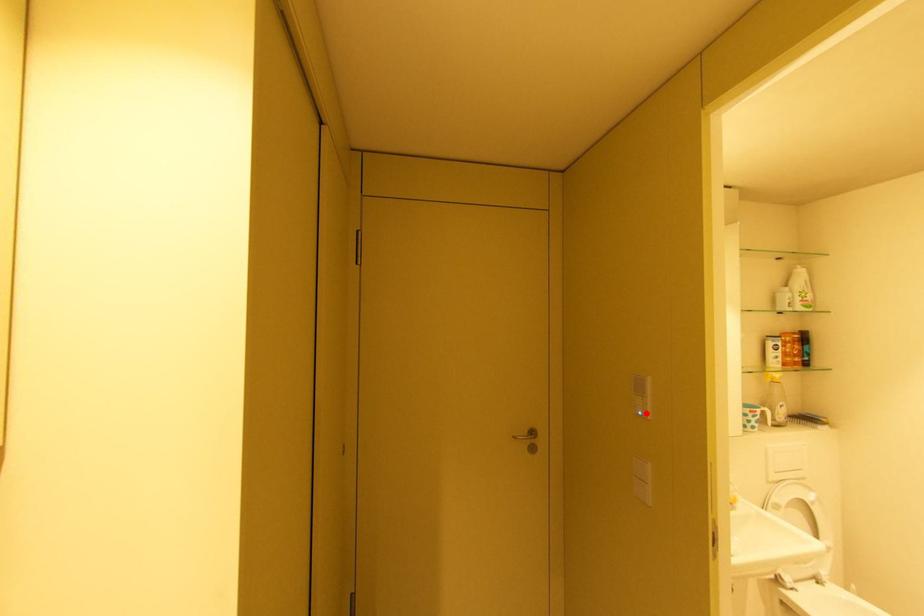
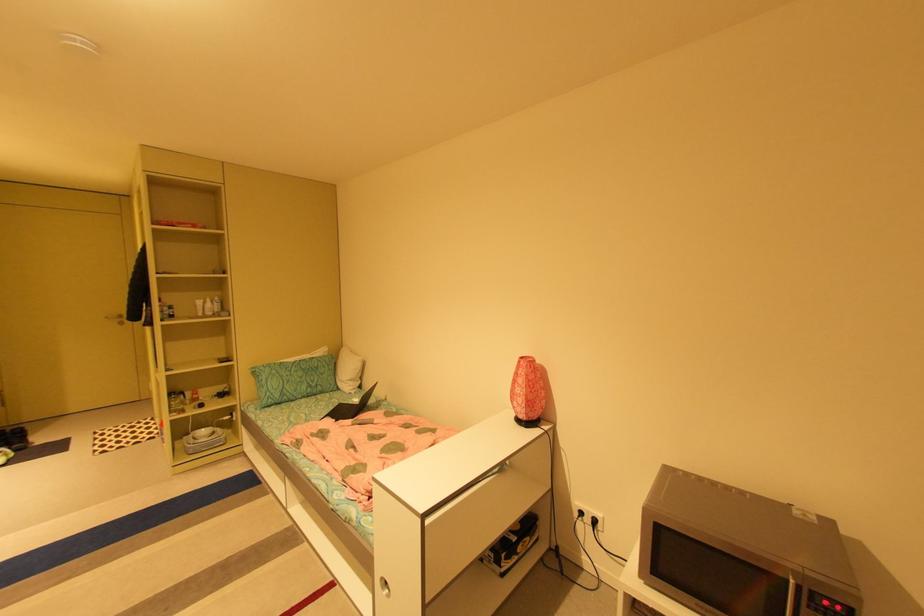
Question: I am providing you with two images of the same scene from different viewpoints. A red point is marked on the first image. Is the red point's position out of view in image 2?

Choices:
 (A) Yes
 (B) No

Answer: (A)